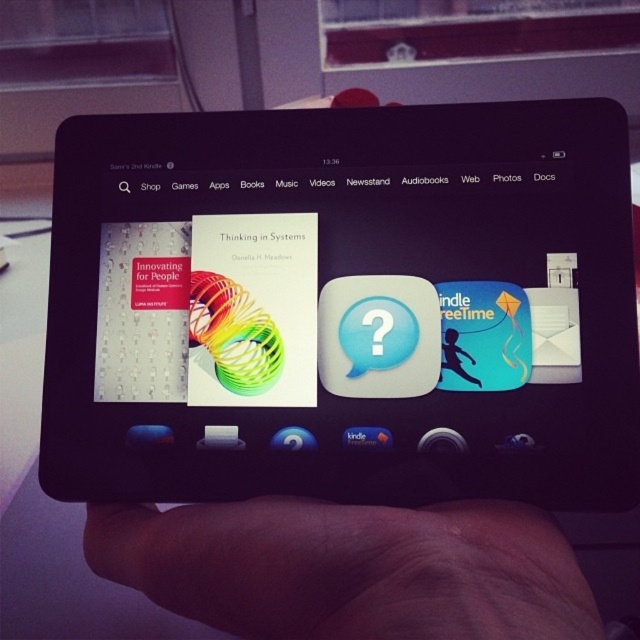
Can you confirm if black glossy tablet at center is positioned to the left of skinny flesh at lower center?

No, black glossy tablet at center is not to the left of skinny flesh at lower center.

Is black glossy tablet at center wider than skinny flesh at lower center?

Yes.

Which is behind, point (195, 285) or point (275, 552)?

Positioned behind is point (195, 285).

Locate an element on the screen. This screenshot has width=640, height=640. black glossy tablet at center is located at coordinates (342, 304).